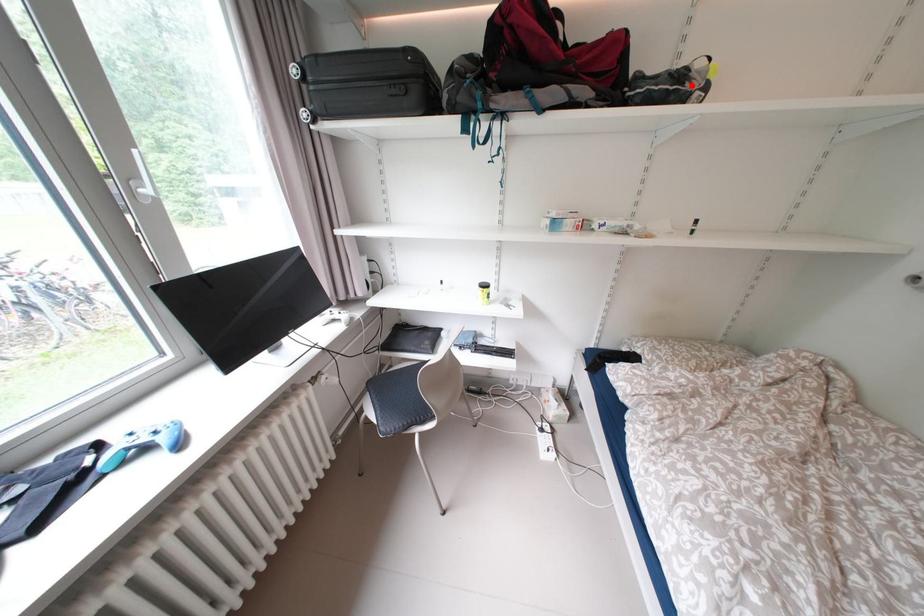
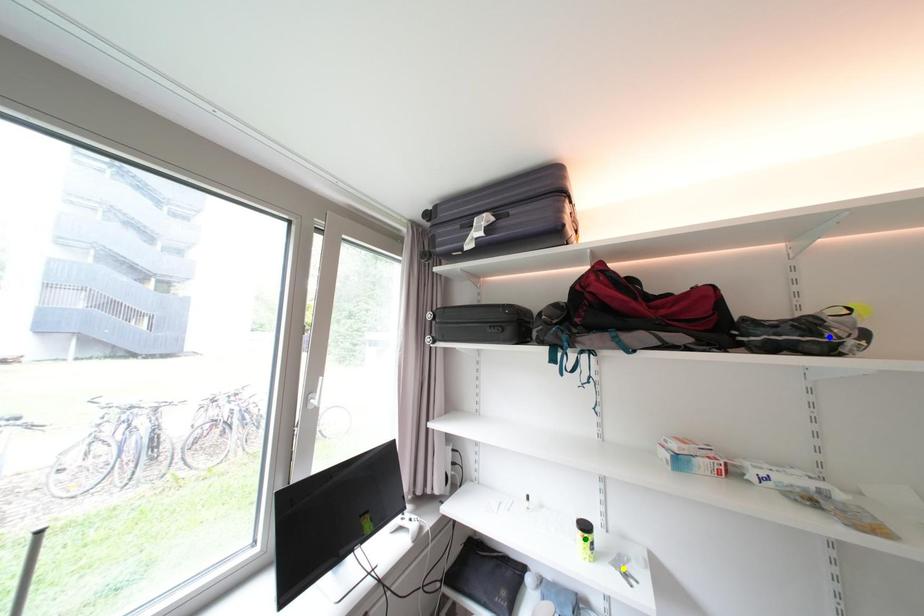
Question: I am providing you with two images of the same scene from different viewpoints. A red point is marked on the first image. You are given multiple points on the second image. Can you choose the point in image 2 that corresponds to the point in image 1?

Choices:
 (A) green point
 (B) yellow point
 (C) blue point

Answer: (C)